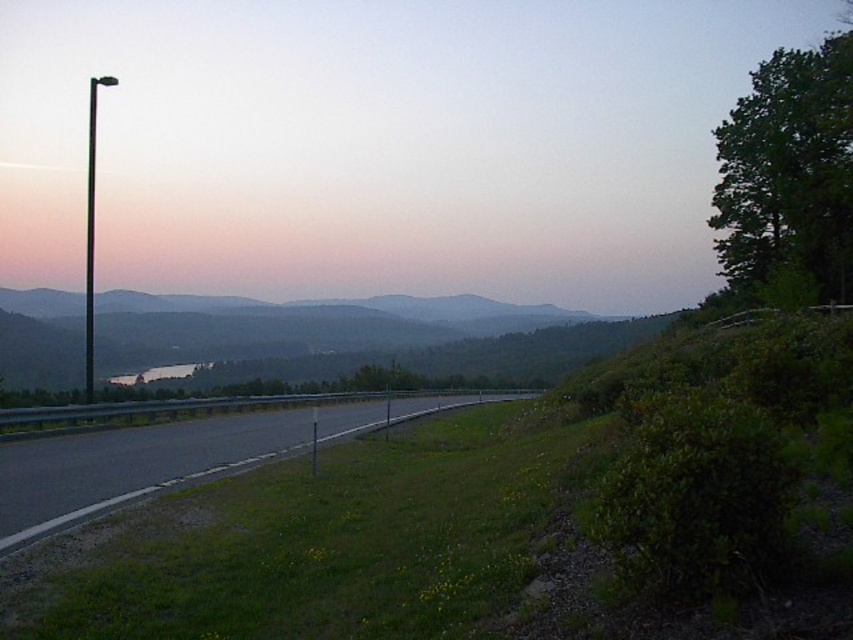
Who is shorter, matte black pole at left or asphalt road at center?

asphalt road at center

Who is positioned more to the left, matte black pole at left or asphalt road at center?

asphalt road at center

At what (x,y) coordinates should I click in order to perform the action: click on matte black pole at left. Please return your answer as a coordinate pair (x, y). The width and height of the screenshot is (853, 640). Looking at the image, I should click on (378, 144).